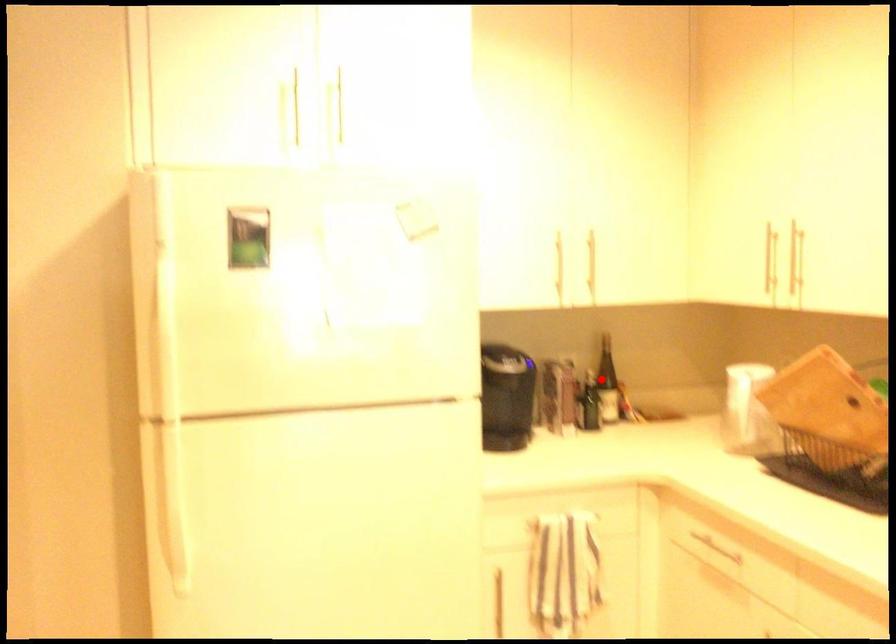
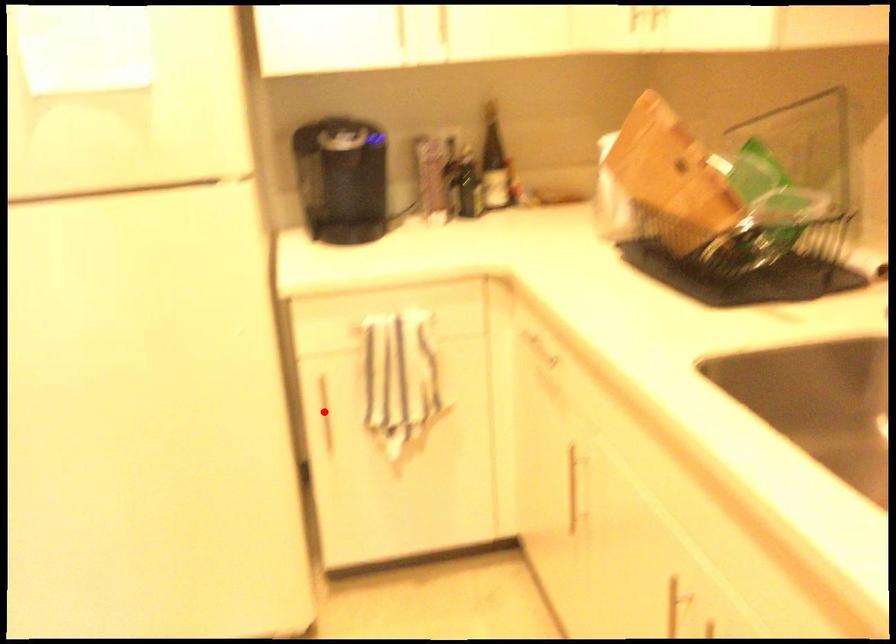
I am providing you with two images of the same scene from different viewpoints. A red point is marked on the first image and another point is marked on the second image. Is the red point in image1 aligned with the point shown in image2?

No